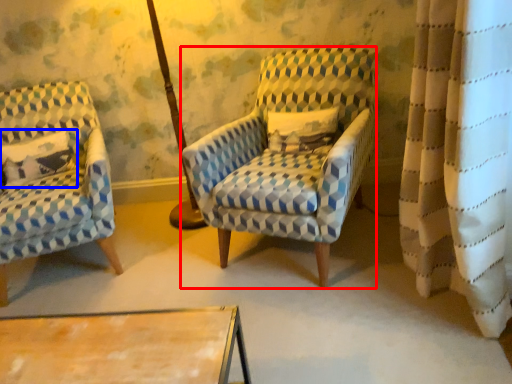
Question: Among these objects, which one is farthest to the camera, chair (highlighted by a red box) or pillow (highlighted by a blue box)?

Choices:
 (A) chair
 (B) pillow

Answer: (B)